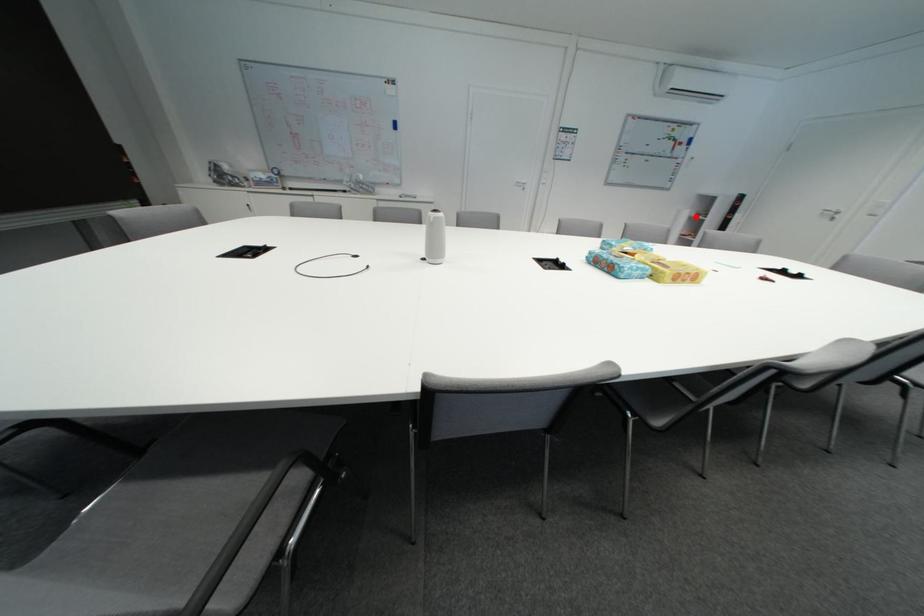
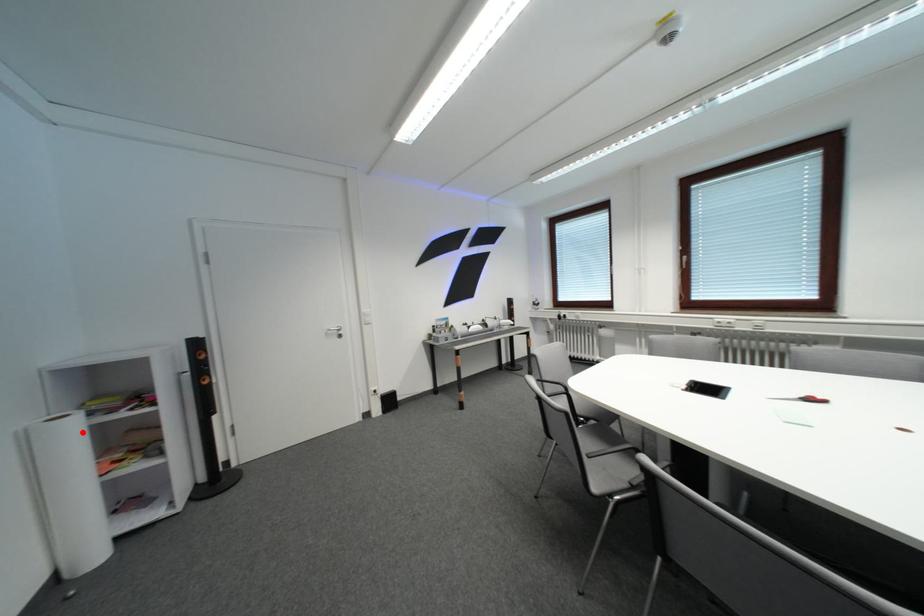
From the picture: I am providing you with two images of the same scene from different viewpoints. A red point is marked on the first image and another point is marked on the second image. Is the red point in image1 aligned with the point shown in image2?

Yes